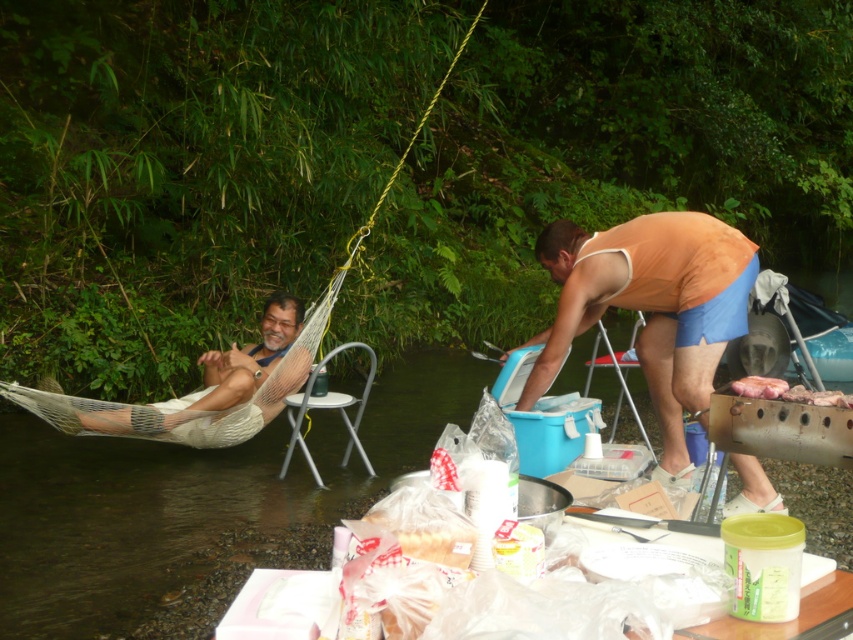
You are standing at the picnic table and want to throw a pebble to hit both points in the scene. The first point is point (589, 308) and the second is point (248, 376). Since you want to hit them in order, which point should you aim for first?

You should aim for point (589, 308) first because it is in front of point (248, 376), so you can hit it first before the pebble reaches the second point.